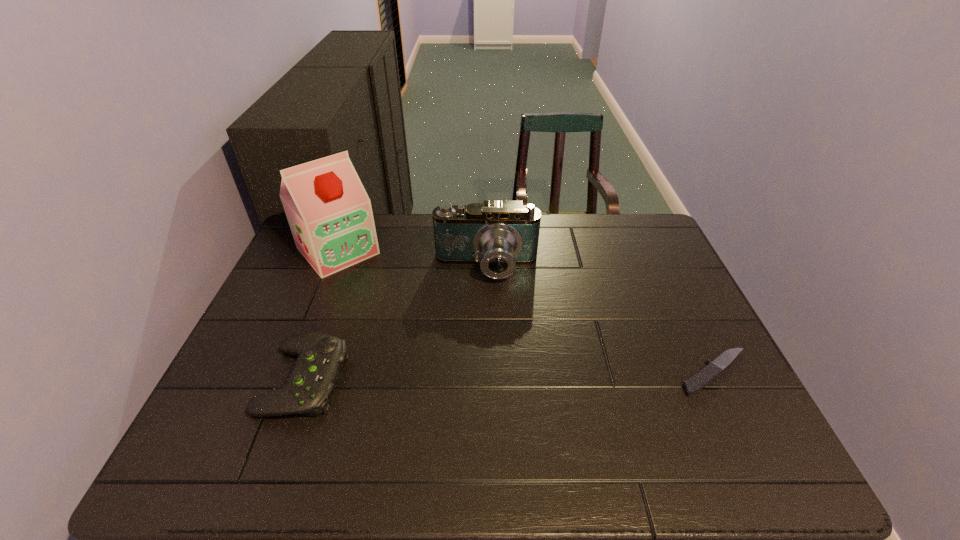
Identify the location of object that is at the right edge. (701, 379).

Image resolution: width=960 pixels, height=540 pixels. In order to click on object located at the far left corner in this screenshot , I will do `click(330, 216)`.

Find the location of a particular element. The height and width of the screenshot is (540, 960). object situated at the near left corner is located at coordinates (316, 371).

Find the location of `object that is at the near right corner`. object that is at the near right corner is located at coordinates (701, 379).

This screenshot has width=960, height=540. Find the location of `free space at the far edge of the desktop`. free space at the far edge of the desktop is located at coordinates (430, 228).

Locate an element on the screen. This screenshot has height=540, width=960. vacant space at the near edge of the desktop is located at coordinates (561, 418).

Locate an element on the screen. free area in between the second tallest object and the control is located at coordinates (396, 324).

Locate an element on the screen. The width and height of the screenshot is (960, 540). empty location between the camcorder and the soya milk is located at coordinates (x=412, y=259).

You are a GUI agent. You are given a task and a screenshot of the screen. Output one action in this format:
    pyautogui.click(x=<x>, y=<y>)
    Task: Click on the free point between the second object from right to left and the soya milk
    The width and height of the screenshot is (960, 540).
    Given the screenshot: What is the action you would take?
    pyautogui.click(x=412, y=259)

Where is `empty space between the steak knife and the tallest object`? empty space between the steak knife and the tallest object is located at coordinates (527, 312).